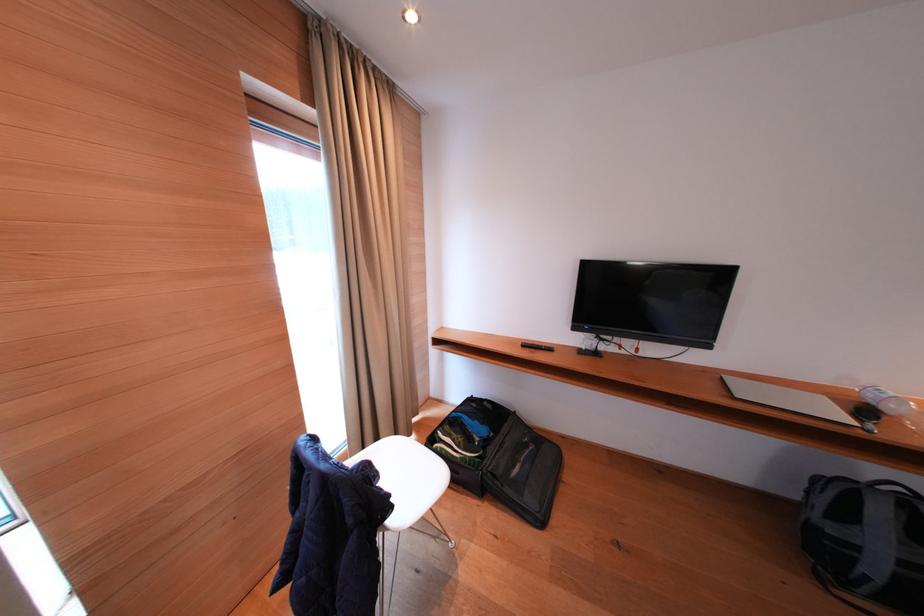
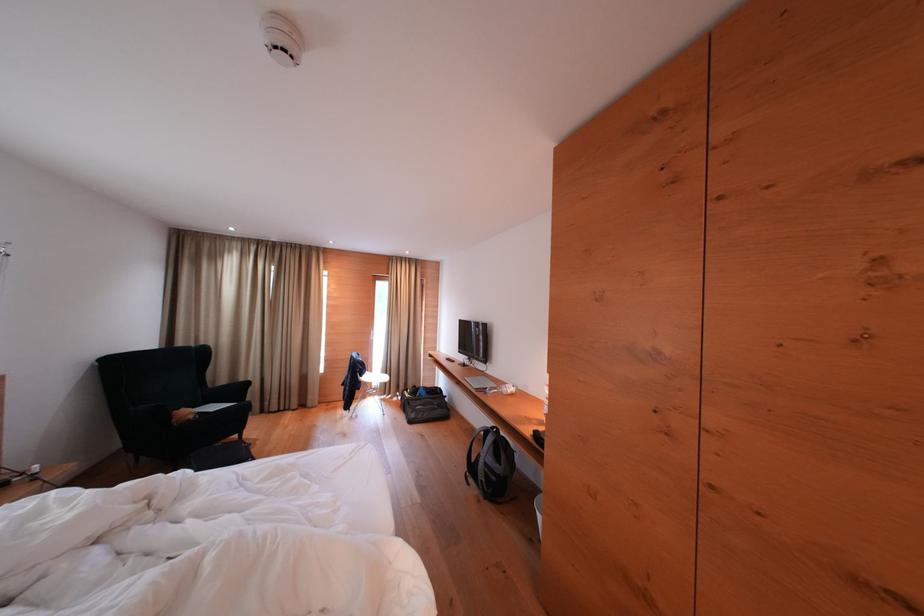
Where in the second image is the point corresponding to [396,500] from the first image?

(369, 373)